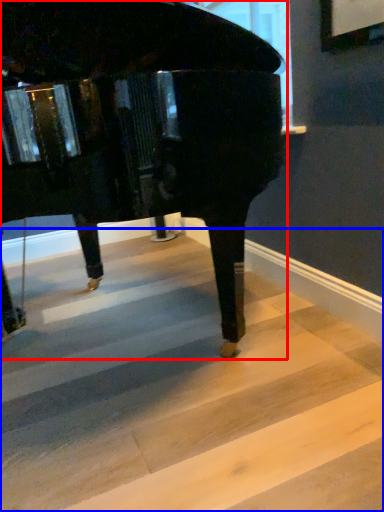
Question: Among these objects, which one is nearest to the camera, piano (highlighted by a red box) or stairwell (highlighted by a blue box)?

Choices:
 (A) piano
 (B) stairwell

Answer: (A)